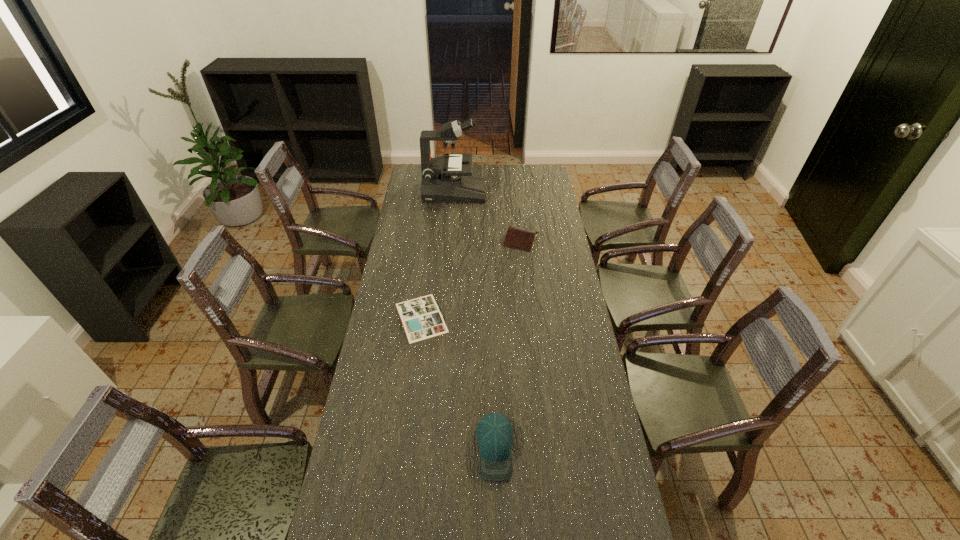
In order to click on free space between the shorter book and the third shortest object in this screenshot , I will do `click(458, 383)`.

You are a GUI agent. You are given a task and a screenshot of the screen. Output one action in this format:
    pyautogui.click(x=<x>, y=<y>)
    Task: Click on the object that is the third closest to the farthest object
    This screenshot has height=540, width=960.
    Given the screenshot: What is the action you would take?
    pyautogui.click(x=494, y=433)

The image size is (960, 540). What are the coordinates of `the second closest object to the nearest object` in the screenshot? It's located at (517, 237).

Where is `free space that satisfies the following two spatial constraints: 1. through the eyepieces of the microscope; 2. on the back side of the right book`? free space that satisfies the following two spatial constraints: 1. through the eyepieces of the microscope; 2. on the back side of the right book is located at coordinates (451, 239).

Where is `free space that satisfies the following two spatial constraints: 1. on the front side of the left book; 2. on the right side of the third shortest object`? The height and width of the screenshot is (540, 960). free space that satisfies the following two spatial constraints: 1. on the front side of the left book; 2. on the right side of the third shortest object is located at coordinates (404, 449).

Locate an element on the screen. The image size is (960, 540). vacant position in the image that satisfies the following two spatial constraints: 1. through the eyepieces of the farthest object; 2. on the back side of the third tallest object is located at coordinates (451, 239).

Where is `free spot that satisfies the following two spatial constraints: 1. through the eyepieces of the farther book; 2. on the left side of the farthest object`? The height and width of the screenshot is (540, 960). free spot that satisfies the following two spatial constraints: 1. through the eyepieces of the farther book; 2. on the left side of the farthest object is located at coordinates (451, 239).

Where is `free space that satisfies the following two spatial constraints: 1. through the eyepieces of the farthest object; 2. on the right side of the second shortest object`? This screenshot has width=960, height=540. free space that satisfies the following two spatial constraints: 1. through the eyepieces of the farthest object; 2. on the right side of the second shortest object is located at coordinates (451, 239).